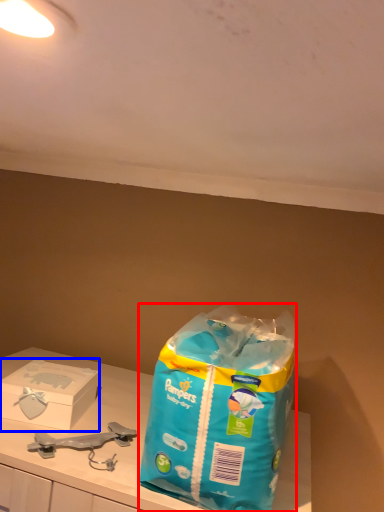
Question: Which object appears closest to the camera in this image, shopping bag (highlighted by a red box) or box (highlighted by a blue box)?

Choices:
 (A) shopping bag
 (B) box

Answer: (A)